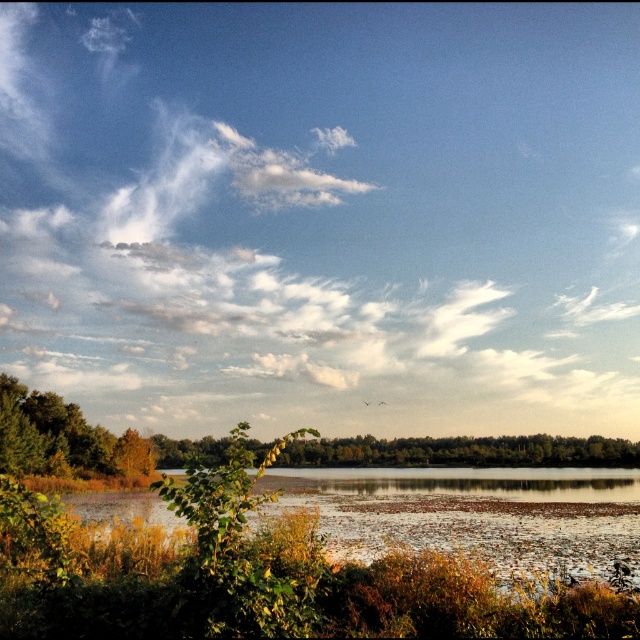
You are standing at the edge of the scene and want to reach the translucent water at center. Which direction should you move in to get there?

The translucent water at center is located at point coordinates, so you should move towards the center of the scene from the edge to reach it.